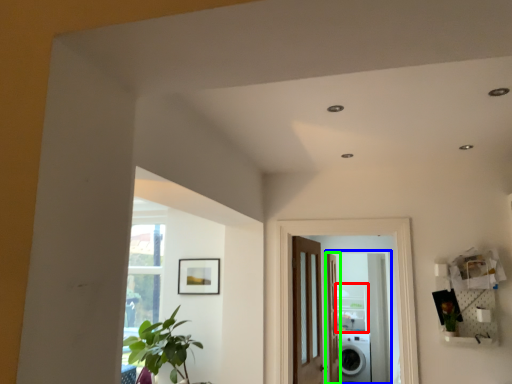
Question: Which object is positioned closest to shelf (highlighted by a red box)? Select from screen door (highlighted by a blue box) and door (highlighted by a green box).

Choices:
 (A) screen door
 (B) door

Answer: (A)